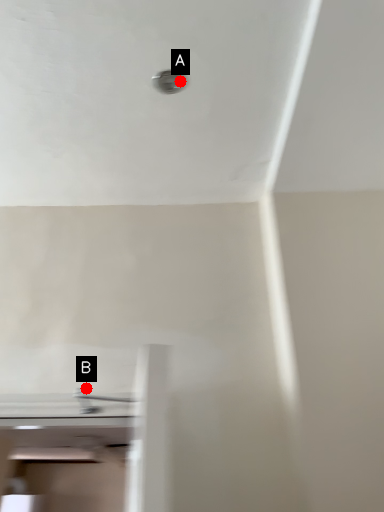
Question: Two points are circled on the image, labeled by A and B beside each circle. Among these points, which one is nearest to the camera?

Choices:
 (A) A is closer
 (B) B is closer

Answer: (A)